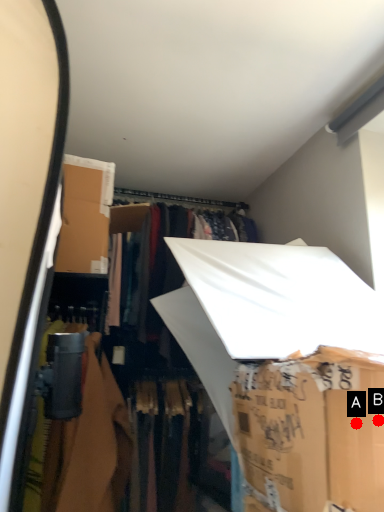
Question: Two points are circled on the image, labeled by A and B beside each circle. Among these points, which one is farthest from the camera?

Choices:
 (A) A is further
 (B) B is further

Answer: (B)